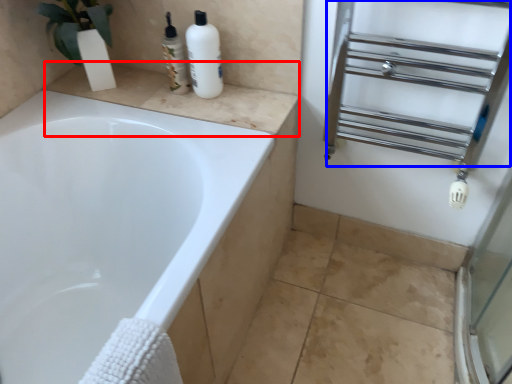
Question: Which object appears farthest to the camera in this image, counter top (highlighted by a red box) or shelf (highlighted by a blue box)?

Choices:
 (A) counter top
 (B) shelf

Answer: (A)